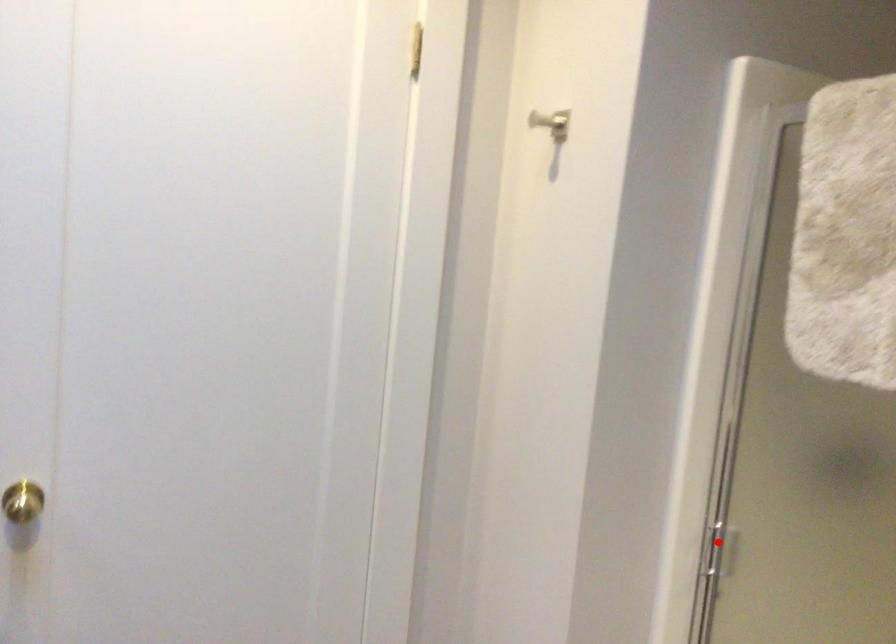
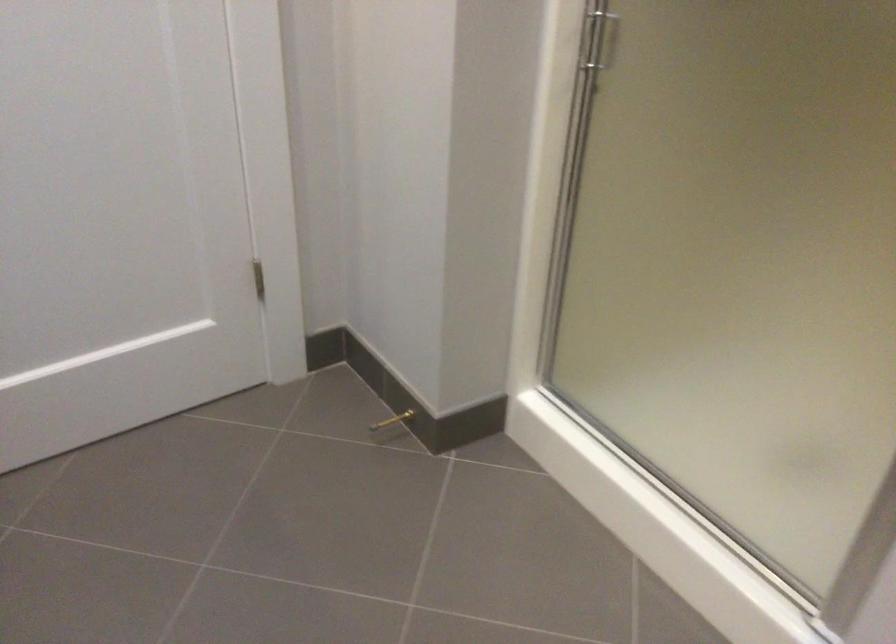
The point at the highlighted location is marked in the first image. Where is the corresponding point in the second image?

(596, 39)